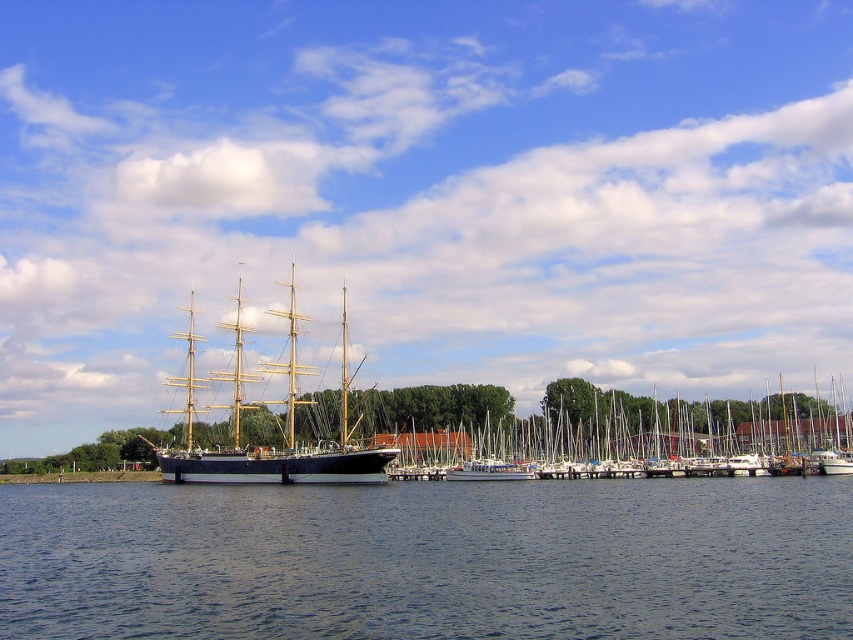
Question: Can you confirm if wooden sailboat at center is smaller than wooden ship at center?

Choices:
 (A) no
 (B) yes

Answer: (B)

Question: Is blue water at center below wooden sailboat at center?

Choices:
 (A) yes
 (B) no

Answer: (B)

Question: Is wooden sailboat at center positioned before wooden ship at center?

Choices:
 (A) no
 (B) yes

Answer: (A)

Question: Among these points, which one is nearest to the camera?

Choices:
 (A) (668, 440)
 (B) (502, 614)

Answer: (B)

Question: Which of the following is the closest to the observer?

Choices:
 (A) (358, 474)
 (B) (560, 438)

Answer: (A)

Question: Which of the following is the closest to the observer?

Choices:
 (A) (366, 504)
 (B) (769, 451)
 (C) (245, 451)

Answer: (A)